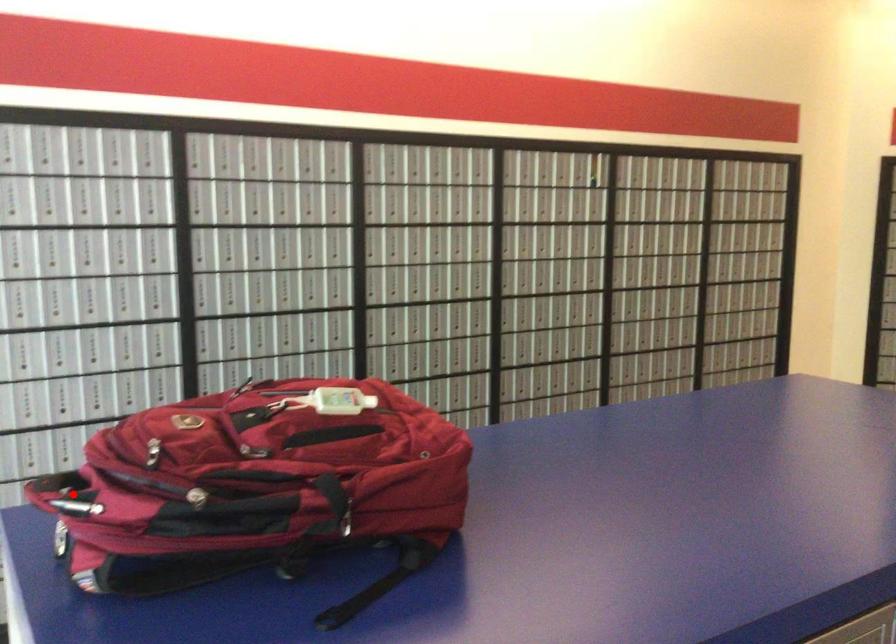
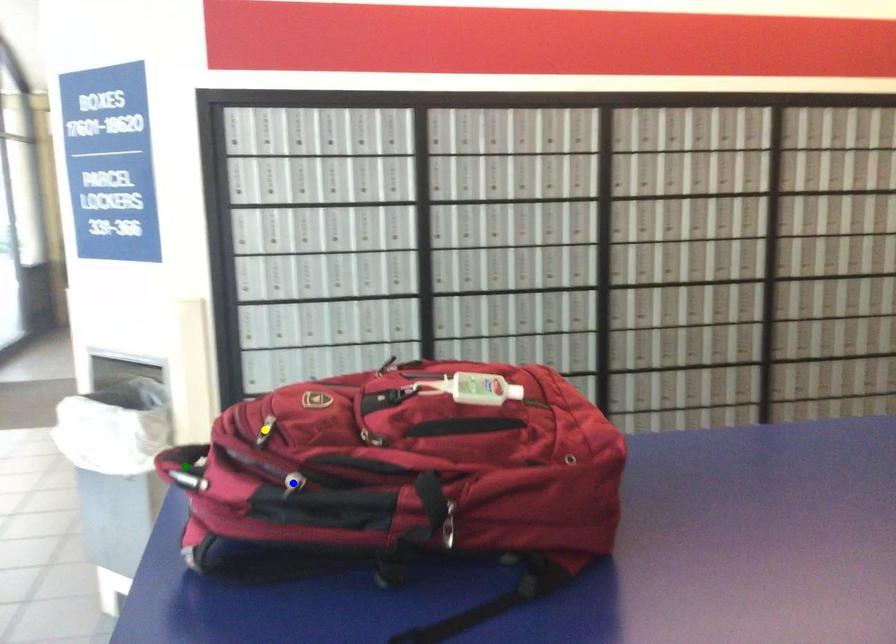
Question: I am providing you with two images of the same scene from different viewpoints. A red point is marked on the first image. You are given multiple points on the second image. Which mark in image 2 goes with the point in image 1?

Choices:
 (A) green point
 (B) blue point
 (C) yellow point

Answer: (A)